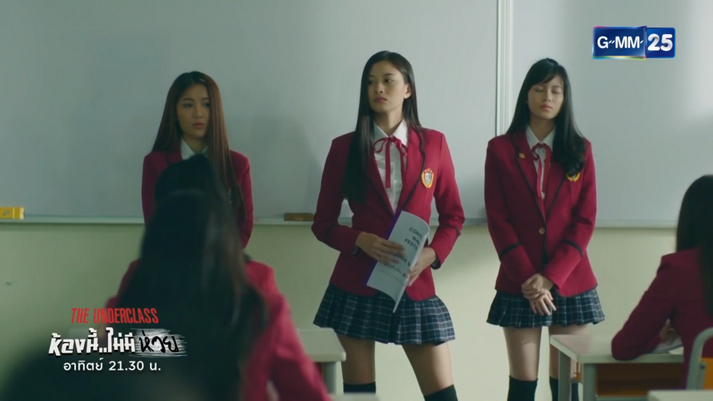
Identify the location of desk. (597, 356).